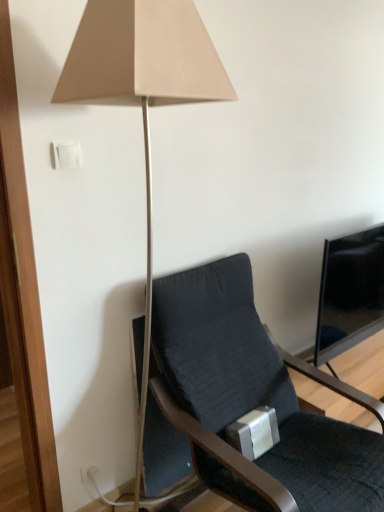
Locate an element on the screen. Image resolution: width=384 pixels, height=512 pixels. free space below black glossy screen at right (from a real-world perspective) is located at coordinates (357, 355).